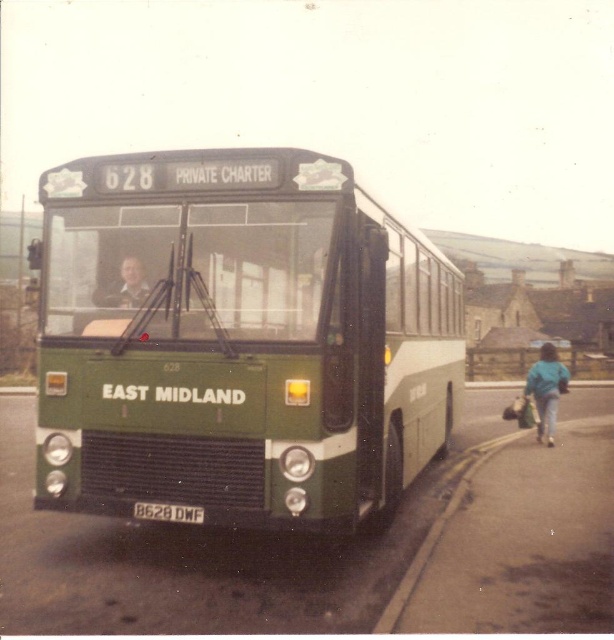
You are a delivery person trying to park your van next to the vintage bus. You notice the yellow painted concrete curb at lower right and the matte green face at center. Which object is bigger in size and would require more space to maneuver around?

The yellow painted concrete curb at lower right is larger in size than the matte green face at center, so it would require more space to maneuver around.

You are standing at the point with coordinates (238, 339). What object are you standing on?

The point with coordinates (238, 339) corresponds to the green matte bus at center.

You are a photographer standing in the scene and want to take a photo of the green matte bus at center and the blue fabric jacket at lower right. Which object should you focus on first if you want to capture both in the same frame without moving the camera?

The green matte bus at center is located above the blue fabric jacket at lower right, so you should focus on the green matte bus at center first to ensure both are in the frame.